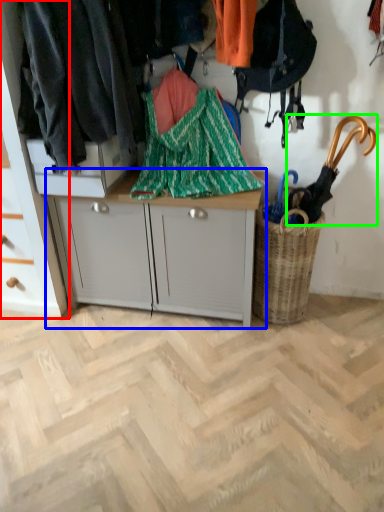
Question: Estimate the real-world distances between objects in this image. Which object is farther from cabinetry (highlighted by a red box), desk (highlighted by a blue box) or umbrella (highlighted by a green box)?

Choices:
 (A) desk
 (B) umbrella

Answer: (B)